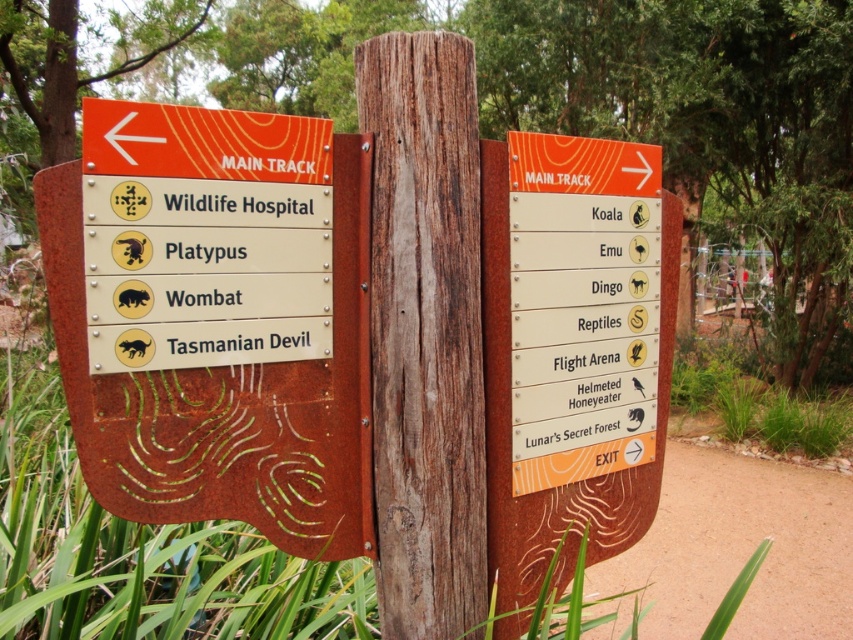
Question: Which object appears farthest from the camera in this image?

Choices:
 (A) weathered wood post at center
 (B) orange wood sign at right
 (C) rusty metal sign at left

Answer: (B)

Question: Does rusty metal sign at left have a lesser width compared to orange wood sign at right?

Choices:
 (A) no
 (B) yes

Answer: (A)

Question: Can you confirm if rusty metal sign at left is wider than weathered wood post at center?

Choices:
 (A) yes
 (B) no

Answer: (A)

Question: Which point is farther from the camera taking this photo?

Choices:
 (A) (535, 211)
 (B) (380, 445)
 (C) (341, 440)

Answer: (A)

Question: Which of the following is the closest to the observer?

Choices:
 (A) rusty metal sign at left
 (B) weathered wood post at center
 (C) orange wood sign at right

Answer: (A)

Question: Can you confirm if weathered wood post at center is wider than orange wood sign at right?

Choices:
 (A) yes
 (B) no

Answer: (B)